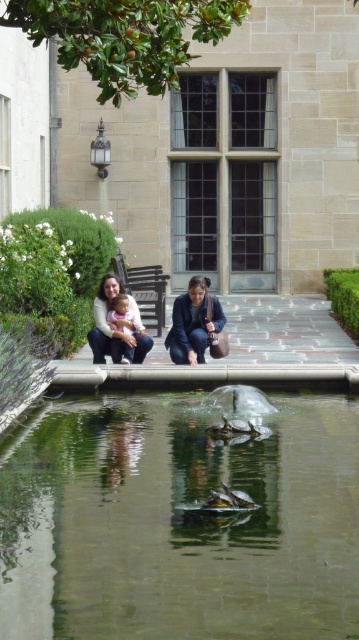
Is point (99, 326) closer to viewer compared to point (174, 356)?

No, (99, 326) is further to viewer.

Does matte white sweater at center appear over matte blue jacket at center?

Correct, matte white sweater at center is located above matte blue jacket at center.

Identify the location of matte white sweater at center. Image resolution: width=359 pixels, height=640 pixels. pos(109,328).

Locate an element on the screen. matte white sweater at center is located at coordinates (109, 328).

Between point (123, 342) and point (127, 301), which one is positioned behind?

The point (127, 301) is behind.

Is matte black jacket at lower center smaller than pink fabric baby at center?

Actually, matte black jacket at lower center might be larger than pink fabric baby at center.

Is point (101, 296) positioned after point (132, 332)?

Yes, it is.

Where is `matte black jacket at lower center`? This screenshot has width=359, height=640. matte black jacket at lower center is located at coordinates (109, 326).

Can you confirm if matte blue jacket at center is positioned to the right of matte black jacket at lower center?

Indeed, matte blue jacket at center is positioned on the right side of matte black jacket at lower center.

Which is below, matte blue jacket at center or matte black jacket at lower center?

matte blue jacket at center is below.

Does point (194, 326) lie behind point (100, 323)?

No, (194, 326) is in front of (100, 323).

Find the location of a particular element. matte blue jacket at center is located at coordinates coord(193,323).